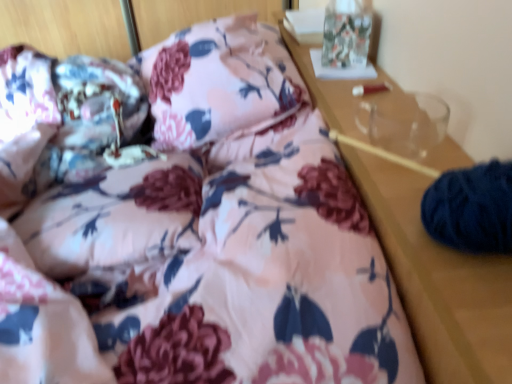
Question: Is dark blue yarn at right, the first pillow positioned from the bottom, taller or shorter than floral fabric pillow at center, arranged as the 2th pillow when viewed from the right?

Choices:
 (A) short
 (B) tall

Answer: (A)

Question: Visually, is dark blue yarn at right, positioned as the first pillow in front-to-back order, positioned to the left or to the right of floral fabric pillow at center, arranged as the 2th pillow when viewed from the front?

Choices:
 (A) left
 (B) right

Answer: (B)

Question: From the image's perspective, is dark blue yarn at right, the second pillow from the back, above or below floral fabric pillow at center, arranged as the 2th pillow when viewed from the front?

Choices:
 (A) above
 (B) below

Answer: (B)

Question: In terms of height, does floral fabric pillow at center, arranged as the 2th pillow when viewed from the right, look taller or shorter compared to dark blue yarn at right, the second pillow viewed from the top?

Choices:
 (A) tall
 (B) short

Answer: (A)

Question: In terms of width, does floral fabric pillow at center, which appears as the 1th pillow when viewed from the back, look wider or thinner when compared to dark blue yarn at right, the second pillow viewed from the top?

Choices:
 (A) thin
 (B) wide

Answer: (B)

Question: From the image's perspective, is floral fabric pillow at center, the 2th pillow from the bottom, located above or below dark blue yarn at right, the second pillow viewed from the top?

Choices:
 (A) below
 (B) above

Answer: (B)

Question: Based on their sizes in the image, would you say floral fabric pillow at center, the 2th pillow from the bottom, is bigger or smaller than dark blue yarn at right, the 2th pillow from the left?

Choices:
 (A) big
 (B) small

Answer: (A)